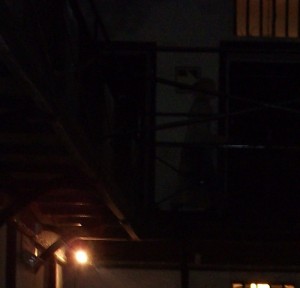
This screenshot has width=300, height=288. In order to click on light in this screenshot , I will do `click(77, 260)`.